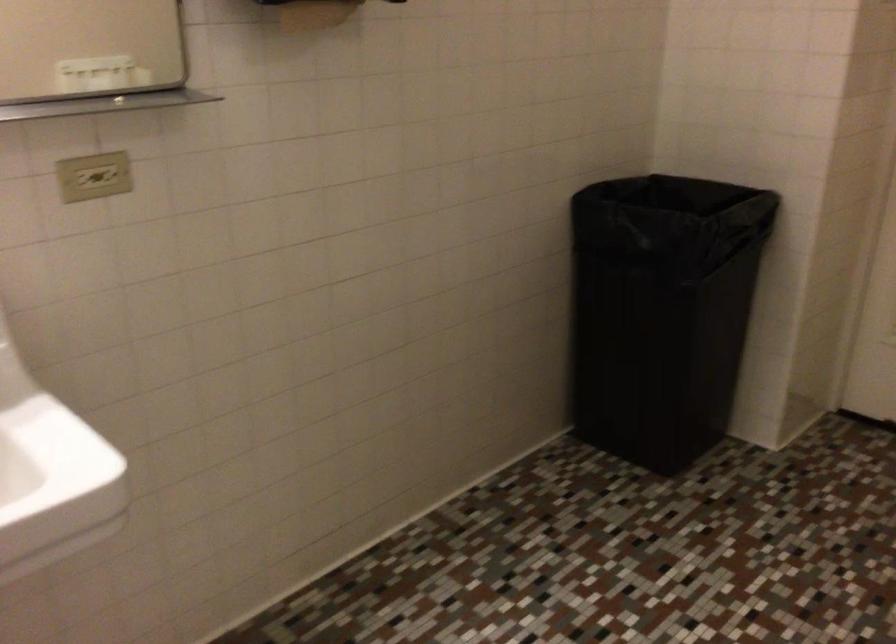
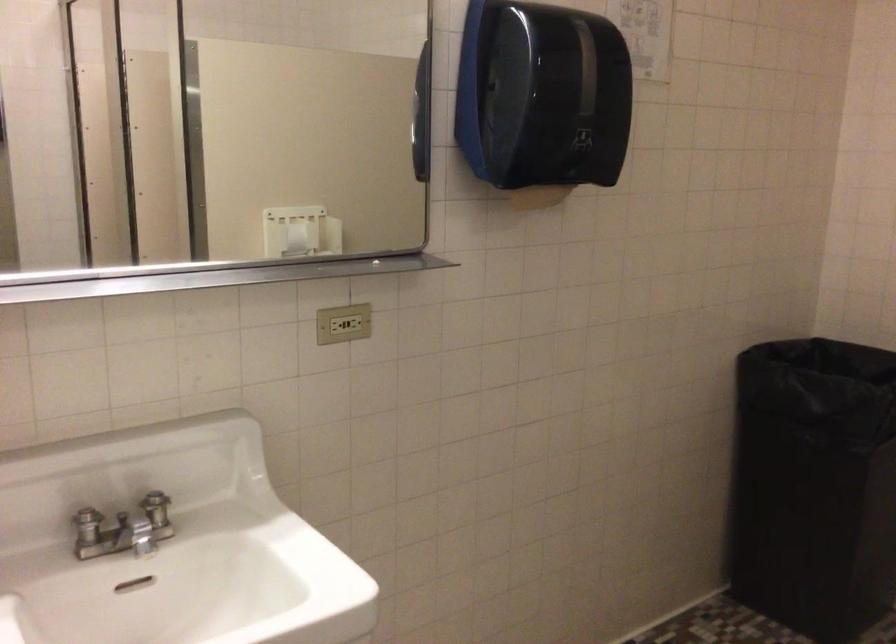
Find the pixel in the second image that matches (106,176) in the first image.

(342, 323)